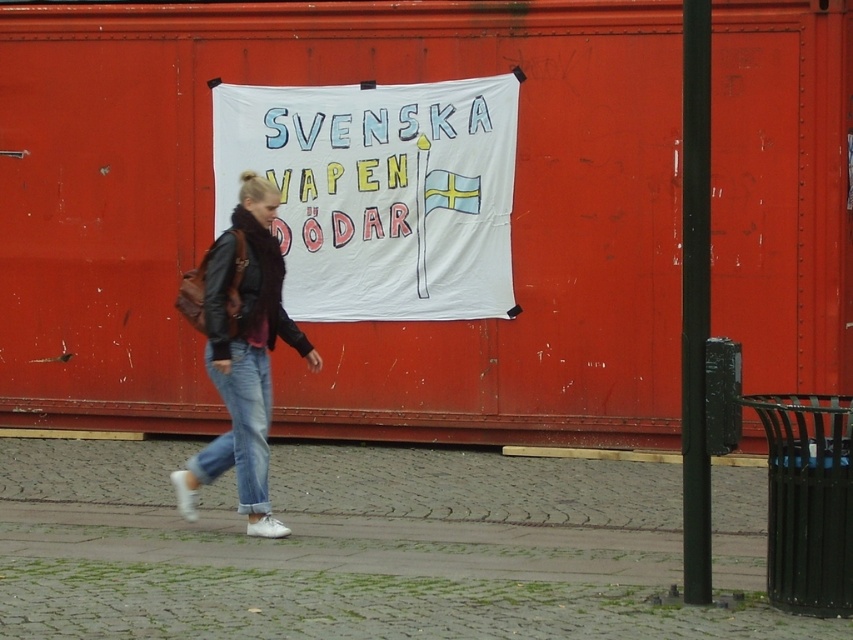
You are standing in the scene and want to touch the white fabric banner at center. To do so, in which direction should you move relative to the blue denim jeans at lower center?

The white fabric banner at center is to the right of the blue denim jeans at lower center, so you should move to the right relative to the blue denim jeans at lower center to reach it.

You are standing at the point marked by the coordinates point (x=241, y=352). Looking around, you see the banner with Swedish flag and the person walking. Where is the denim jeans at center relative to your current position?

The denim jeans at center is at the same position as your current location marked by point (x=241, y=352).

You are a fashion designer observing a person wearing denim jeans at center and blue denim jeans at lower center. Which pair of jeans appears larger in size?

The denim jeans at center appears larger in size than the blue denim jeans at lower center.